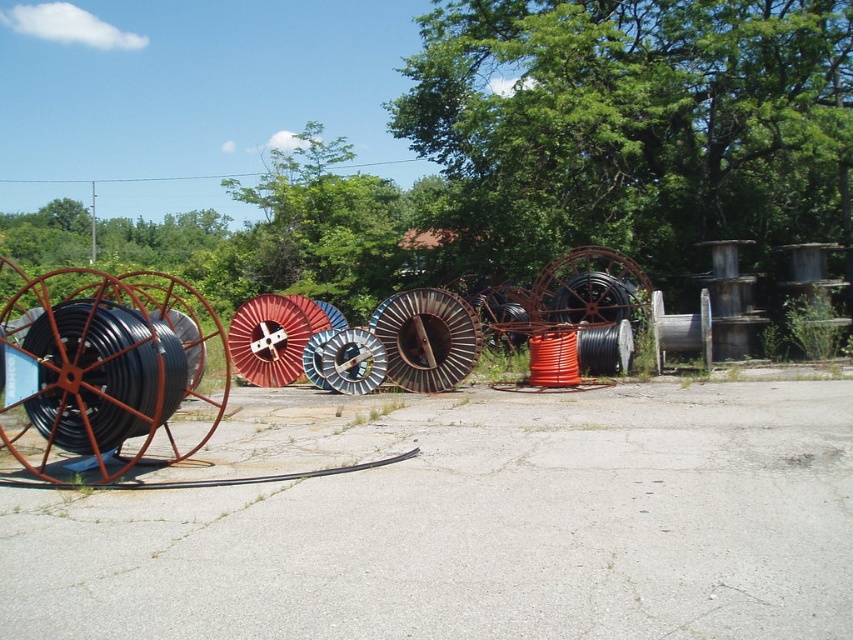
Question: Can you confirm if red matte spool at center is smaller than metallic silver cable reel at center?

Choices:
 (A) yes
 (B) no

Answer: (B)

Question: Which point is closer to the camera?

Choices:
 (A) (401, 307)
 (B) (566, 321)

Answer: (A)

Question: Is red matte spool at center in front of metallic silver cable reel at center?

Choices:
 (A) no
 (B) yes

Answer: (A)

Question: Which of the following is the farthest from the observer?

Choices:
 (A) rusty metal wheel at center
 (B) matte black cable reel at left
 (C) red matte spool at center

Answer: (C)

Question: Does black matte cable reel at left appear on the right side of metallic silver cable reel at center?

Choices:
 (A) no
 (B) yes

Answer: (A)

Question: Which point is closer to the camera taking this photo?

Choices:
 (A) (61, 353)
 (B) (457, 353)
 (C) (601, 296)
 (D) (183, 397)

Answer: (A)